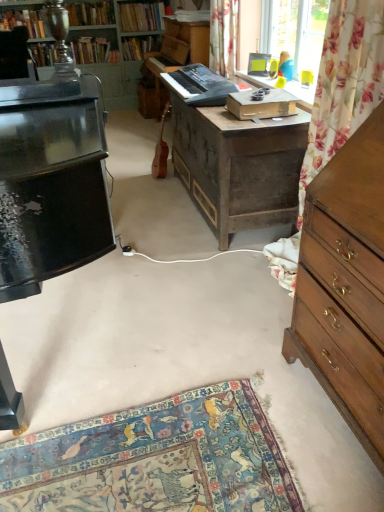
Question: Can you confirm if floral fabric curtain at upper center is positioned to the right of hardcover book at upper center, which is the 5th book in left-to-right order?

Choices:
 (A) no
 (B) yes

Answer: (B)

Question: Considering the relative sizes of floral fabric curtain at upper center and hardcover book at upper center, which is the 5th book in left-to-right order, in the image provided, is floral fabric curtain at upper center thinner than hardcover book at upper center, which is the 5th book in left-to-right order,?

Choices:
 (A) yes
 (B) no

Answer: (A)

Question: Can you confirm if floral fabric curtain at upper center is bigger than hardcover book at upper center, the first book positioned from the right?

Choices:
 (A) yes
 (B) no

Answer: (A)

Question: From the image's perspective, is floral fabric curtain at upper center below hardcover book at upper center, the first book positioned from the right?

Choices:
 (A) no
 (B) yes

Answer: (B)

Question: Does floral fabric curtain at upper center turn towards hardcover book at upper center, the first book positioned from the right?

Choices:
 (A) yes
 (B) no

Answer: (B)

Question: From a real-world perspective, is hardcover book at upper center, which is the 5th book in left-to-right order, physically located above or below hardcover book at upper center, the 2th book when ordered from right to left?

Choices:
 (A) below
 (B) above

Answer: (A)

Question: Is hardcover book at upper center, which is the 5th book in left-to-right order, spatially inside hardcover book at upper center, which ranks as the 4th book in left-to-right order, or outside of it?

Choices:
 (A) inside
 (B) outside

Answer: (B)

Question: Based on their positions, is hardcover book at upper center, the first book positioned from the right, located to the left or right of hardcover book at upper center, the 2th book when ordered from right to left?

Choices:
 (A) left
 (B) right

Answer: (B)

Question: Considering the positions of point (127, 53) and point (119, 15), is point (127, 53) closer or farther from the camera than point (119, 15)?

Choices:
 (A) farther
 (B) closer

Answer: (A)

Question: In the image, is wooden chest of drawers at right on the left side or the right side of floral fabric at upper right?

Choices:
 (A) left
 (B) right

Answer: (B)

Question: Relative to floral fabric at upper right, is wooden chest of drawers at right in front or behind?

Choices:
 (A) behind
 (B) front

Answer: (B)

Question: In terms of size, does wooden chest of drawers at right appear bigger or smaller than floral fabric at upper right?

Choices:
 (A) small
 (B) big

Answer: (B)

Question: From their relative heights in the image, would you say wooden chest of drawers at right is taller or shorter than floral fabric at upper right?

Choices:
 (A) tall
 (B) short

Answer: (B)

Question: Would you say brown wood guitar at center is to the left or to the right of floral fabric curtain at upper center in the picture?

Choices:
 (A) left
 (B) right

Answer: (A)

Question: Considering the positions of brown wood guitar at center and floral fabric curtain at upper center in the image, is brown wood guitar at center wider or thinner than floral fabric curtain at upper center?

Choices:
 (A) wide
 (B) thin

Answer: (B)